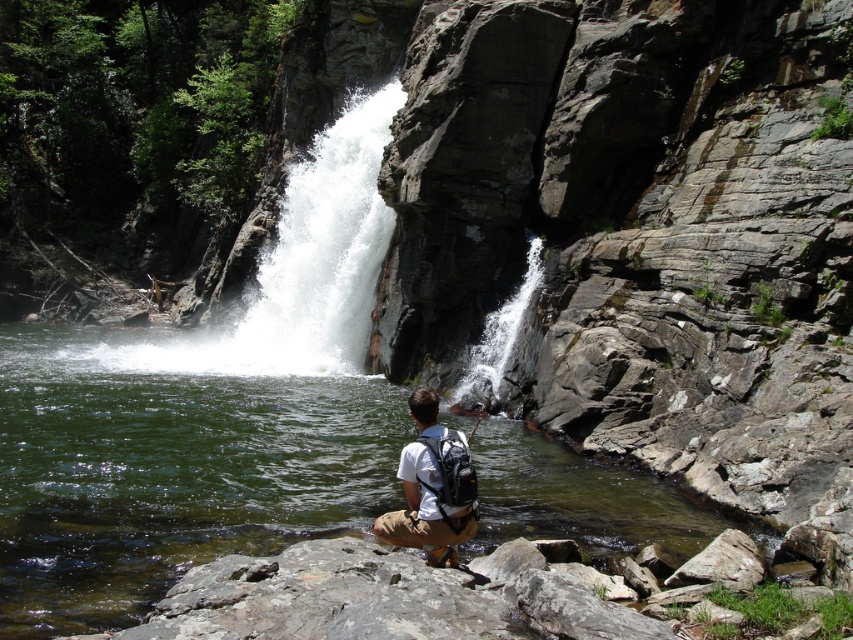
Based on the photo, you are planning to take a photo of the clear water at center and the white matte backpack at center. Which object should you focus on first if you want to capture both in the same frame without moving the camera?

The clear water at center is wider than the white matte backpack at center, so you should focus on the white matte backpack at center first to ensure it fits within the frame.

You are a hiker who wants to cross the clear water at center. You have a white matte backpack at center. Can you safely cross the water while carrying your backpack?

The clear water at center is taller than the white matte backpack at center. Since the water is deeper than the backpack, it might be risky to cross as the backpack could get submerged and heavy. It is advisable to find a safer route or remove the backpack before attempting to cross.